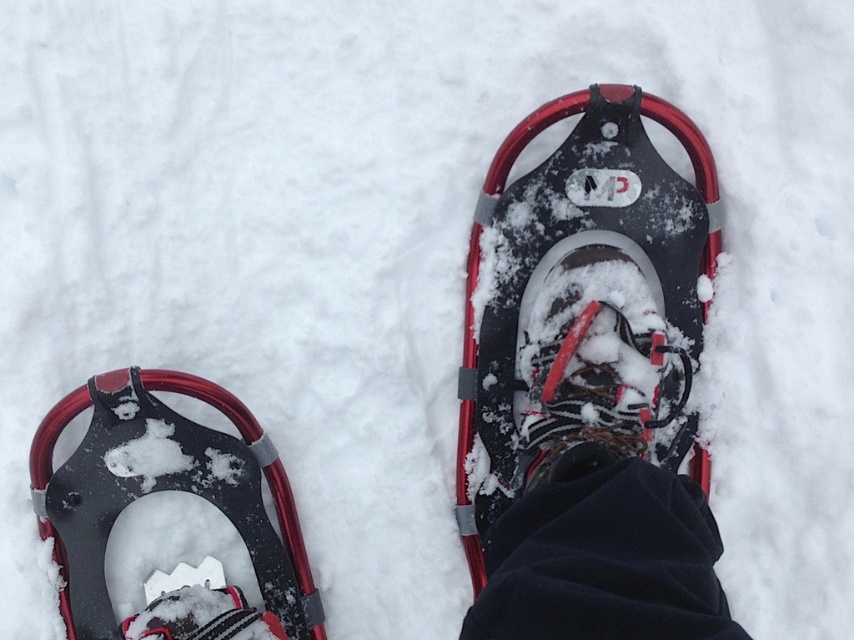
Question: Is black rubber snowshoe at center positioned at the back of matte black snowshoe at lower left?

Choices:
 (A) yes
 (B) no

Answer: (B)

Question: Does black rubber snowshoe at center come in front of matte black snowshoe at lower left?

Choices:
 (A) no
 (B) yes

Answer: (B)

Question: Is black rubber snowshoe at center positioned before matte black snowshoe at lower left?

Choices:
 (A) no
 (B) yes

Answer: (B)